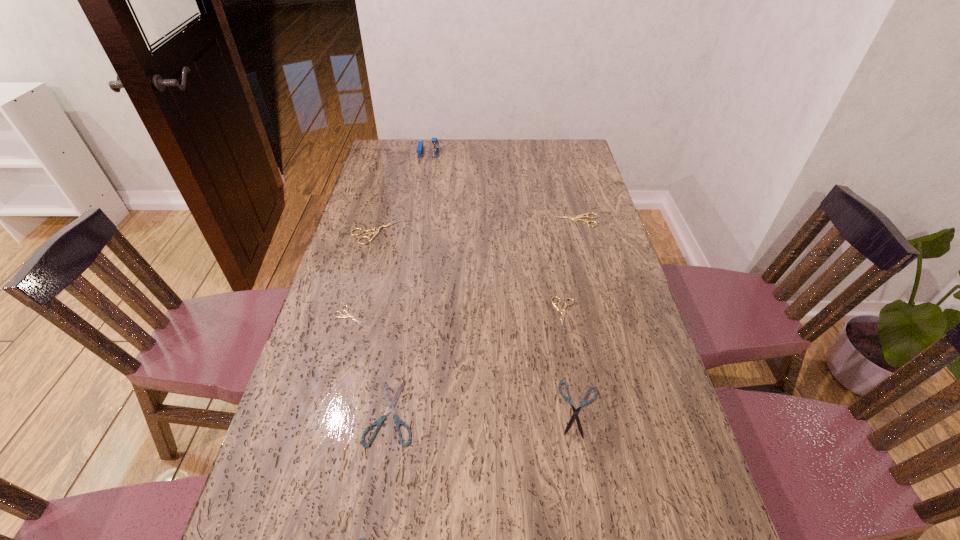
Where is `vacant space located 0.170m on the right of the stapler`? vacant space located 0.170m on the right of the stapler is located at coordinates (478, 152).

You are a GUI agent. You are given a task and a screenshot of the screen. Output one action in this format:
    pyautogui.click(x=<x>, y=<y>)
    Task: Click on the free space located on the back of the tallest shears
    
    Given the screenshot: What is the action you would take?
    pyautogui.click(x=394, y=168)

You are a GUI agent. You are given a task and a screenshot of the screen. Output one action in this format:
    pyautogui.click(x=<x>, y=<y>)
    Task: Click on the vacant space located 0.260m on the left of the sixth shortest shears
    This screenshot has width=960, height=540.
    Given the screenshot: What is the action you would take?
    pyautogui.click(x=480, y=220)

Image resolution: width=960 pixels, height=540 pixels. Identify the location of free space located on the right of the biggest black shears. (579, 413).

This screenshot has width=960, height=540. Find the location of `free region located on the left of the third biggest beige shears`. free region located on the left of the third biggest beige shears is located at coordinates (507, 313).

I want to click on vacant space located 0.160m on the back of the second biggest black shears, so click(x=566, y=330).

Find the location of a particular element. Image resolution: width=960 pixels, height=540 pixels. free space located on the front of the smallest beige shears is located at coordinates (304, 472).

This screenshot has height=540, width=960. In order to click on object that is positioned at the far edge in this screenshot , I will do `click(419, 150)`.

This screenshot has width=960, height=540. I want to click on object that is at the right edge, so click(585, 215).

Find the location of a particular element. This screenshot has width=960, height=540. vacant region at the far edge is located at coordinates (488, 156).